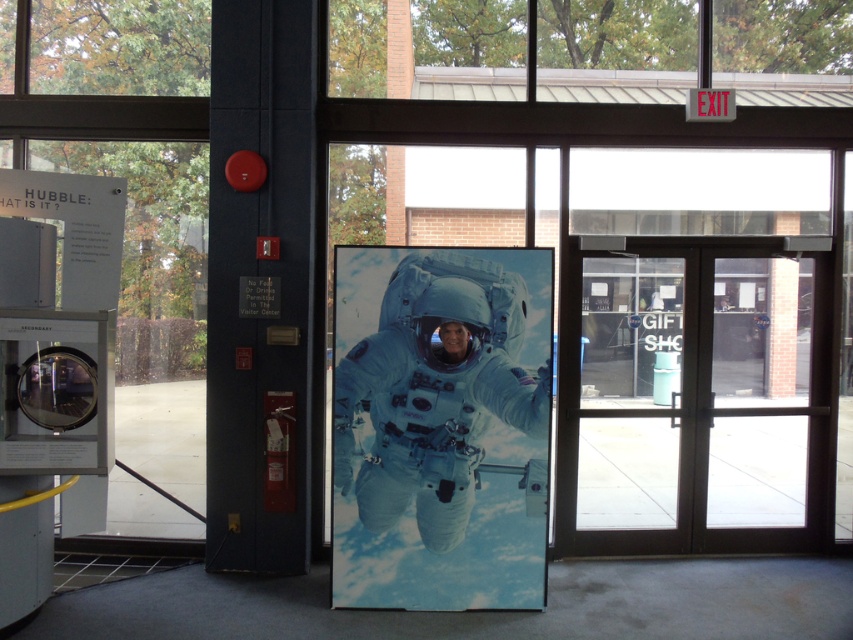
Question: Among these points, which one is nearest to the camera?

Choices:
 (A) (821, 308)
 (B) (494, 588)

Answer: (B)

Question: Can you confirm if brown glass doors at center is bigger than white glossy astronaut suit at center?

Choices:
 (A) yes
 (B) no

Answer: (A)

Question: Which object is the farthest from the transparent glass door at center?

Choices:
 (A) white glossy astronaut suit at center
 (B) brown glass doors at center

Answer: (A)

Question: Can you confirm if brown glass doors at center is positioned to the left of white glossy astronaut suit at center?

Choices:
 (A) yes
 (B) no

Answer: (B)

Question: Which of the following is the closest to the observer?

Choices:
 (A) transparent glass door at center
 (B) white glossy astronaut suit at center
 (C) brown glass doors at center

Answer: (B)

Question: Does brown glass doors at center lie in front of white glossy astronaut suit at center?

Choices:
 (A) yes
 (B) no

Answer: (B)